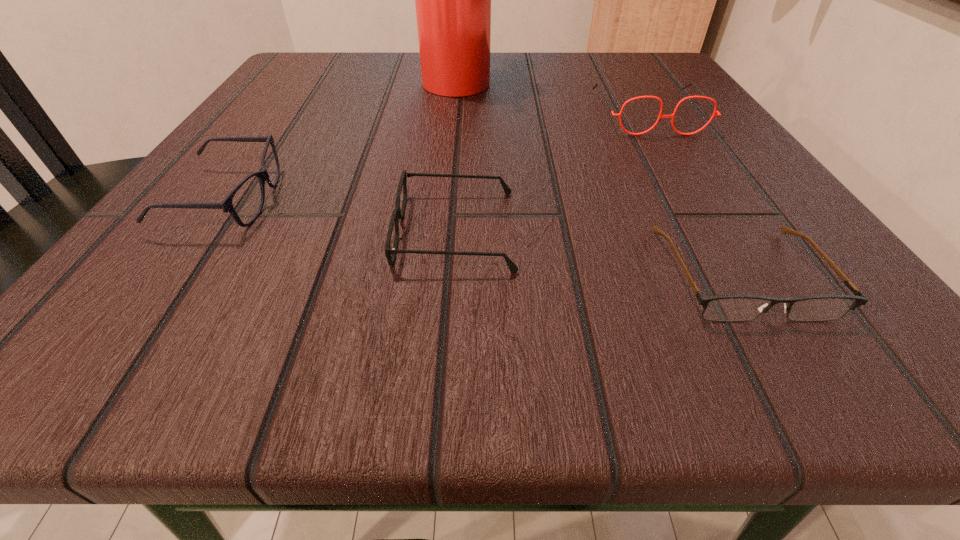
Locate an element on the screen. The width and height of the screenshot is (960, 540). the tallest object is located at coordinates (452, 0).

Find the location of a particular element. This screenshot has width=960, height=540. the farthest spectacles is located at coordinates (703, 96).

Locate an element on the screen. The image size is (960, 540). the second tallest object is located at coordinates [x=703, y=96].

Where is `the leftmost object`? The width and height of the screenshot is (960, 540). the leftmost object is located at coordinates (226, 205).

Identify the location of the third shortest object. (226, 205).

You are a GUI agent. You are given a task and a screenshot of the screen. Output one action in this format:
    pyautogui.click(x=<x>, y=<y>)
    Task: Click on the third spectacles from right to left
    
    Given the screenshot: What is the action you would take?
    pyautogui.click(x=397, y=214)

At what (x,y) coordinates should I click in order to perform the action: click on vacant space located 0.220m on the right of the fire extinguisher. Please return your answer as a coordinate pair (x, y). This screenshot has height=540, width=960. Looking at the image, I should click on (612, 78).

Where is `free space located on the front-facing side of the farthest spectacles`? Image resolution: width=960 pixels, height=540 pixels. free space located on the front-facing side of the farthest spectacles is located at coordinates (743, 271).

At what (x,y) coordinates should I click in order to perform the action: click on blank area located 0.190m on the front-facing side of the leftmost spectacles. Please return your answer as a coordinate pair (x, y). The image size is (960, 540). Looking at the image, I should click on (432, 199).

Identify the location of vacant region located 0.100m on the front-facing side of the second spectacles from left to right. This screenshot has height=540, width=960. (309, 230).